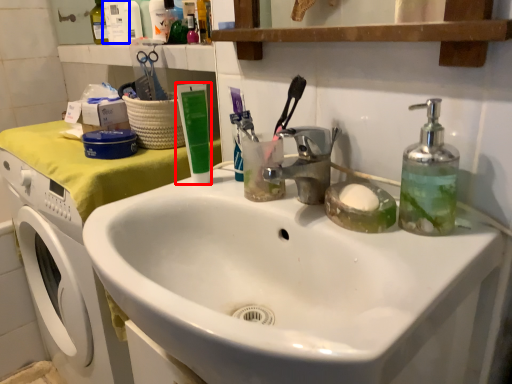
Question: Among these objects, which one is nearest to the camera, toothpaste (highlighted by a red box) or toiletry (highlighted by a blue box)?

Choices:
 (A) toothpaste
 (B) toiletry

Answer: (A)